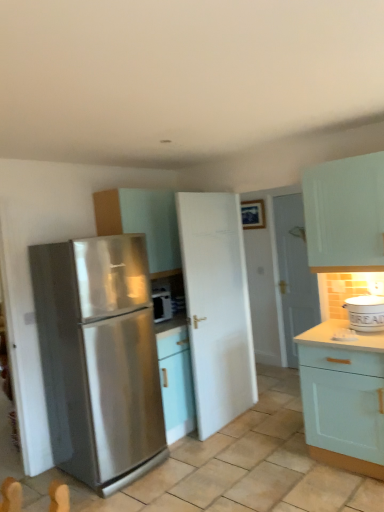
Question: From the image's perspective, is white matte door at center, arranged as the second door when viewed from the right, positioned above or below white glossy door at center, the 1th door positioned from the back?

Choices:
 (A) above
 (B) below

Answer: (B)

Question: Considering the positions of white matte door at center, acting as the 2th door starting from the back, and white glossy door at center, positioned as the 2th door in left-to-right order, in the image, is white matte door at center, acting as the 2th door starting from the back, wider or thinner than white glossy door at center, positioned as the 2th door in left-to-right order,?

Choices:
 (A) thin
 (B) wide

Answer: (B)

Question: Based on their relative distances, which object is farther from the stainless steel refrigerator at left?

Choices:
 (A) stainless steel microwave at center, arranged as the 2th appliance when viewed from the front
 (B) light teal wood cabinet at lower right, the second cabinetry from the top
 (C) white ceramic bucket at right, which is counted as the 2th appliance, starting from the left
 (D) matte white cabinet at center, arranged as the second cabinetry when ordered from the bottom
 (E) white matte door at center, arranged as the second door when viewed from the right

Answer: (C)

Question: Which of these objects is positioned farthest from the white glossy door at center, which appears as the first door when viewed from the right?

Choices:
 (A) stainless steel refrigerator at left
 (B) light teal wood cabinet at lower right, positioned as the 1th cabinetry in right-to-left order
 (C) white matte door at center, arranged as the second door when viewed from the right
 (D) stainless steel microwave at center, placed as the 1th appliance when sorted from left to right
 (E) white ceramic bucket at right, which is the 1th appliance from right to left

Answer: (A)